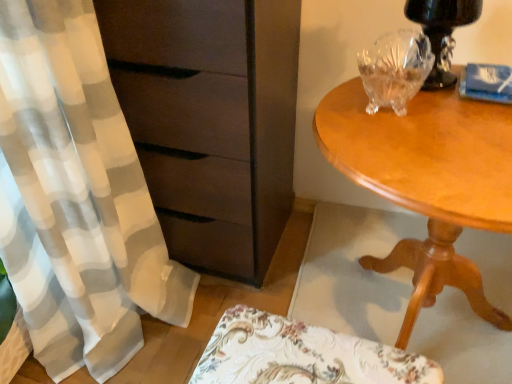
Question: Considering the relative sizes of transparent crystal bowl at upper right and black glossy table lamp at upper right in the image provided, is transparent crystal bowl at upper right thinner than black glossy table lamp at upper right?

Choices:
 (A) no
 (B) yes

Answer: (A)

Question: Is transparent crystal bowl at upper right taller than black glossy table lamp at upper right?

Choices:
 (A) yes
 (B) no

Answer: (B)

Question: Is transparent crystal bowl at upper right looking in the opposite direction of black glossy table lamp at upper right?

Choices:
 (A) yes
 (B) no

Answer: (B)

Question: Considering the relative positions of transparent crystal bowl at upper right and black glossy table lamp at upper right in the image provided, is transparent crystal bowl at upper right in front of black glossy table lamp at upper right?

Choices:
 (A) yes
 (B) no

Answer: (A)

Question: Is transparent crystal bowl at upper right wider than black glossy table lamp at upper right?

Choices:
 (A) yes
 (B) no

Answer: (A)

Question: From a real-world perspective, relative to floral fabric cushion at lower center, is black glossy table lamp at upper right vertically above or below?

Choices:
 (A) above
 (B) below

Answer: (A)

Question: Is black glossy table lamp at upper right taller or shorter than floral fabric cushion at lower center?

Choices:
 (A) tall
 (B) short

Answer: (B)

Question: In terms of width, does black glossy table lamp at upper right look wider or thinner when compared to floral fabric cushion at lower center?

Choices:
 (A) thin
 (B) wide

Answer: (A)

Question: In the image, is black glossy table lamp at upper right positioned in front of or behind floral fabric cushion at lower center?

Choices:
 (A) behind
 (B) front

Answer: (A)

Question: From the image's perspective, is floral fabric cushion at lower center located above or below transparent crystal bowl at upper right?

Choices:
 (A) below
 (B) above

Answer: (A)

Question: From a real-world perspective, is floral fabric cushion at lower center positioned above or below transparent crystal bowl at upper right?

Choices:
 (A) below
 (B) above

Answer: (A)

Question: In terms of height, does floral fabric cushion at lower center look taller or shorter compared to transparent crystal bowl at upper right?

Choices:
 (A) tall
 (B) short

Answer: (A)

Question: Would you say floral fabric cushion at lower center is inside or outside transparent crystal bowl at upper right?

Choices:
 (A) inside
 (B) outside

Answer: (B)

Question: In the image, is transparent crystal bowl at upper right positioned in front of or behind floral fabric cushion at lower center?

Choices:
 (A) front
 (B) behind

Answer: (B)

Question: In the image, is transparent crystal bowl at upper right on the left side or the right side of floral fabric cushion at lower center?

Choices:
 (A) right
 (B) left

Answer: (A)